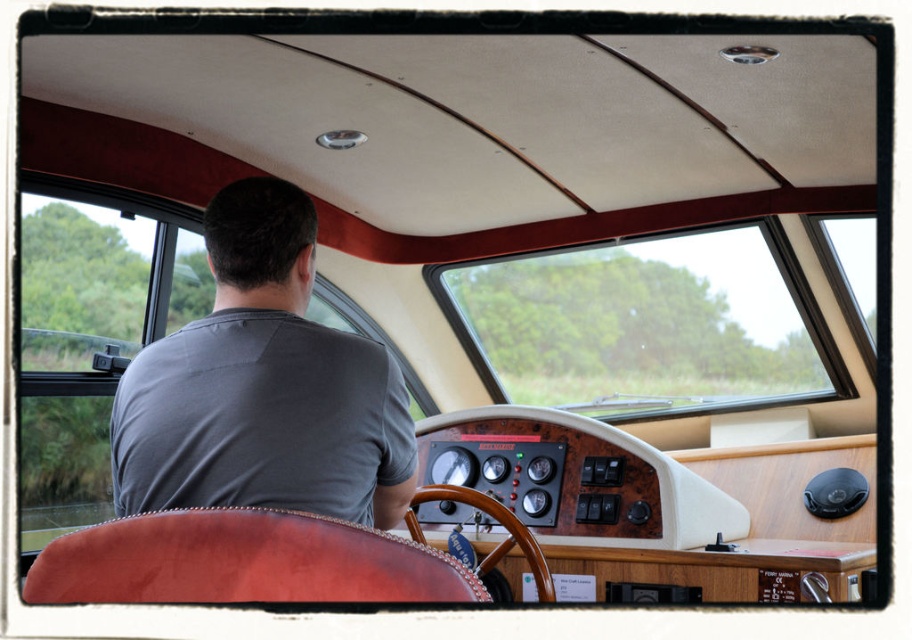
Question: Which point is closer to the camera?

Choices:
 (A) (317, 333)
 (B) (527, 548)

Answer: (A)

Question: Is gray cotton shirt at center bigger than wooden at center?

Choices:
 (A) yes
 (B) no

Answer: (A)

Question: Observing the image, what is the correct spatial positioning of gray cotton shirt at center in reference to wooden at center?

Choices:
 (A) above
 (B) below

Answer: (A)

Question: Can you confirm if gray cotton shirt at center is positioned above wooden at center?

Choices:
 (A) yes
 (B) no

Answer: (A)

Question: Which object appears farthest from the camera in this image?

Choices:
 (A) wooden at center
 (B) gray cotton shirt at center

Answer: (A)

Question: Which of the following is the closest to the observer?

Choices:
 (A) (228, 394)
 (B) (417, 492)

Answer: (A)